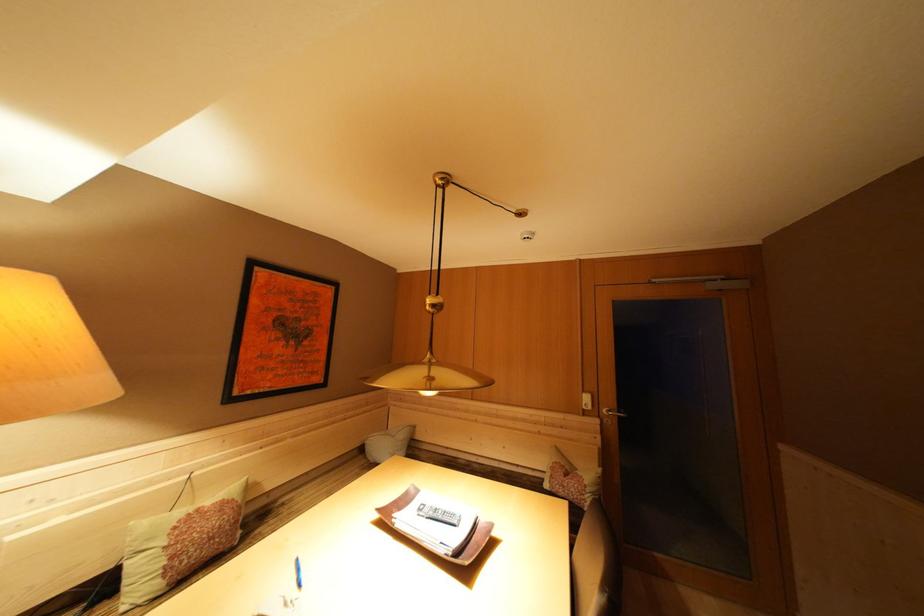
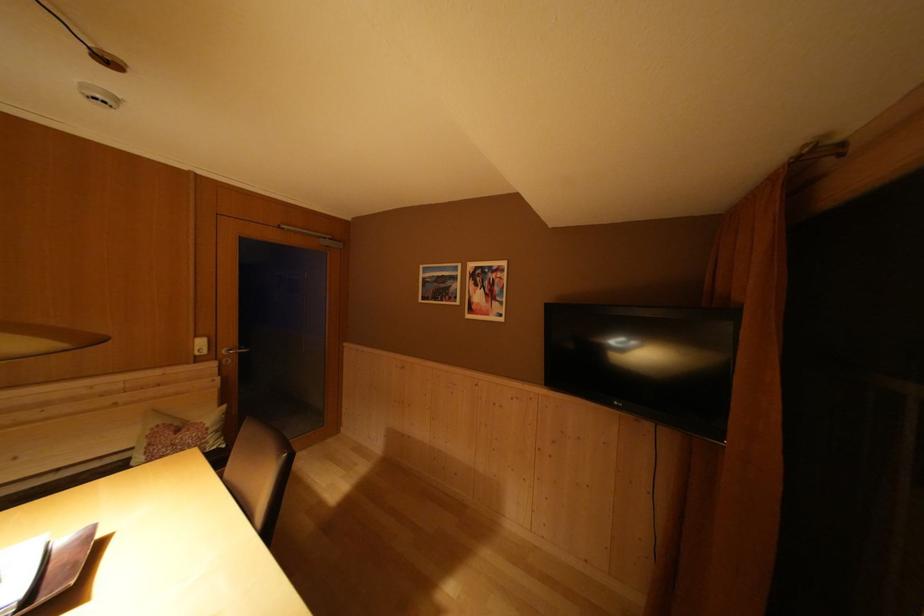
The point at (590, 397) is marked in the first image. Where is the corresponding point in the second image?

(203, 342)